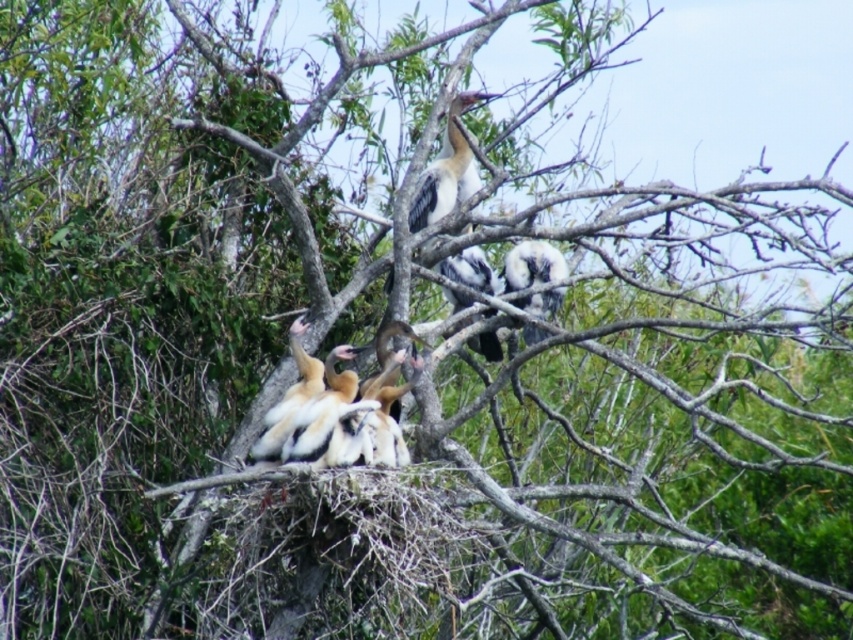
Question: Which point appears farthest from the camera in this image?

Choices:
 (A) (297, 406)
 (B) (532, 284)

Answer: (B)

Question: Is white fluffy feathers at center to the left of white fluffy feathers at upper center from the viewer's perspective?

Choices:
 (A) no
 (B) yes

Answer: (B)

Question: Can you confirm if white fluffy feathers at center is wider than white fluffy feathers at upper center?

Choices:
 (A) yes
 (B) no

Answer: (A)

Question: Is white fluffy feathers at center to the left of white fluffy feathers at upper center from the viewer's perspective?

Choices:
 (A) yes
 (B) no

Answer: (A)